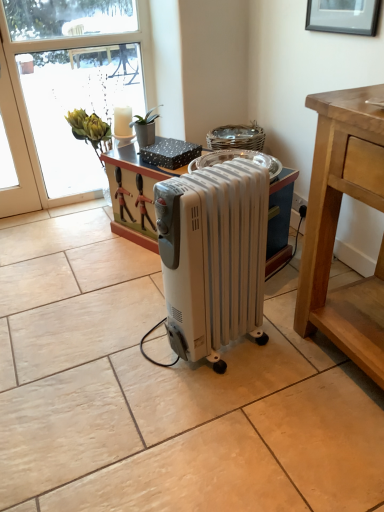
You are a GUI agent. You are given a task and a screenshot of the screen. Output one action in this format:
    pyautogui.click(x=<x>, y=<y>)
    Task: Click on the free space to the right of white plastic radiator at center
    This screenshot has height=512, width=384.
    Given the screenshot: What is the action you would take?
    pyautogui.click(x=297, y=349)